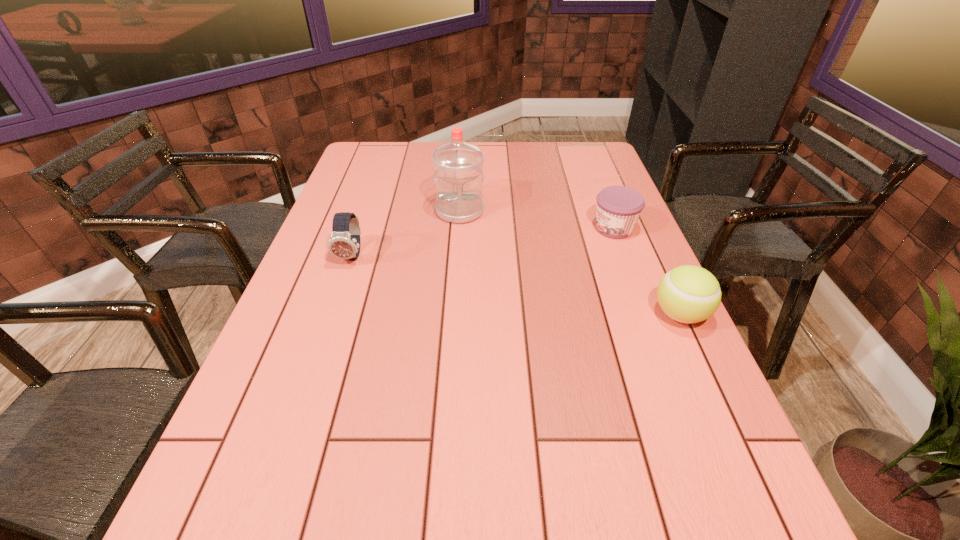
Identify the location of vacant space located 0.230m on the front label of the shortest object. (531, 261).

Identify the location of vacant area located 0.230m on the handle side of the water bottle. (467, 277).

I want to click on free space located on the handle side of the water bottle, so click(x=466, y=272).

This screenshot has height=540, width=960. What are the coordinates of `blank space located on the handle side of the water bottle` in the screenshot? It's located at (463, 239).

This screenshot has height=540, width=960. In order to click on object that is positioned at the left edge in this screenshot , I will do `click(344, 243)`.

Image resolution: width=960 pixels, height=540 pixels. Find the location of `tennis ball that is at the right edge`. tennis ball that is at the right edge is located at coordinates (689, 294).

Find the location of a particular element. This screenshot has height=540, width=960. jam at the right edge is located at coordinates (618, 207).

At what (x,y) coordinates should I click in order to perform the action: click on vacant area at the near edge of the desktop. Please return your answer as a coordinate pair (x, y). This screenshot has height=540, width=960. Looking at the image, I should click on (524, 464).

Locate an element on the screen. Image resolution: width=960 pixels, height=540 pixels. free space at the left edge is located at coordinates (303, 262).

In the image, there is a desktop. Where is `vacant space at the right edge`? vacant space at the right edge is located at coordinates (642, 334).